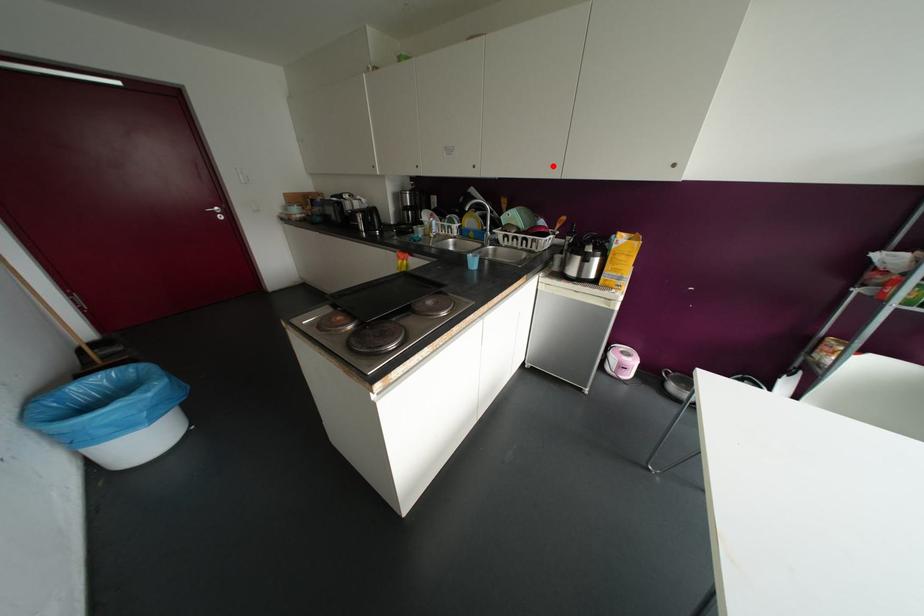
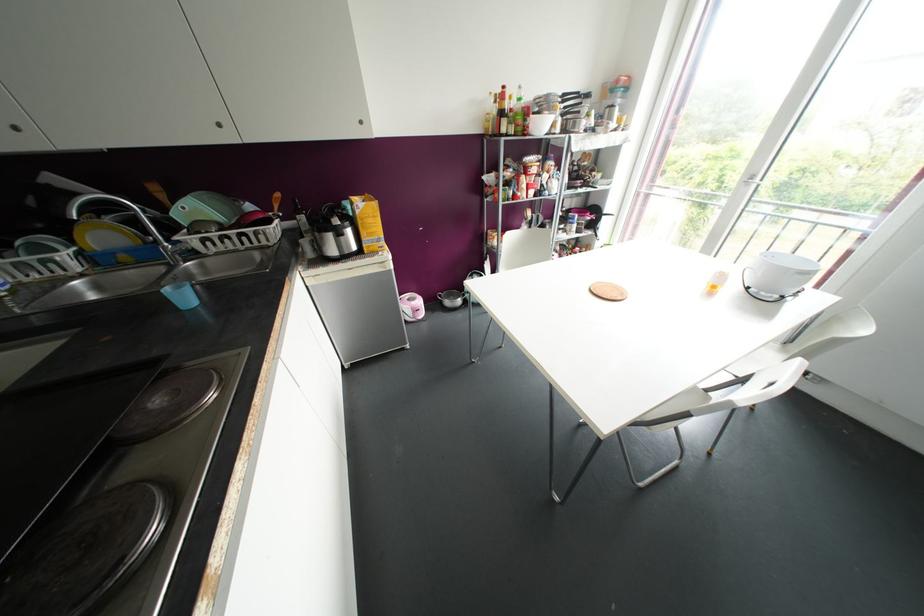
Question: I am providing you with two images of the same scene from different viewpoints. A red point is marked on the first image. Can you still see the location of the red point in image 2?

Choices:
 (A) Yes
 (B) No

Answer: (A)